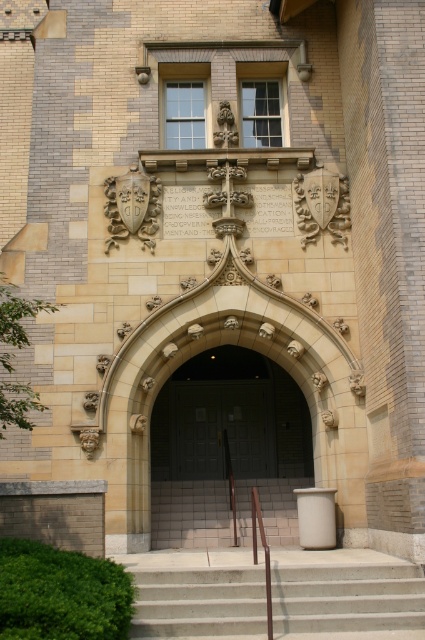
Which is above, dark gray wooden door at center or brown polished wood handrail at center?

Positioned higher is dark gray wooden door at center.

Is point (189, 534) in front of point (260, 518)?

Yes, it is in front of point (260, 518).

Measure the distance between point (x=207, y=531) and camera.

Point (x=207, y=531) and camera are 150.60 feet apart from each other.

Identify the location of dark gray wooden door at center. (229, 445).

Between concrete stairs at lower center and dark wood door at center, which one has more height?

dark wood door at center

Does point (320, 621) come in front of point (206, 477)?

Yes, point (320, 621) is closer to viewer.

At what (x,y) coordinates should I click in order to perform the action: click on concrete stairs at lower center. Please return your answer as a coordinate pair (x, y). Looking at the image, I should click on (348, 596).

How much distance is there between dark gray wooden door at center and concrete stairs at lower center?

dark gray wooden door at center is 65.93 feet away from concrete stairs at lower center.

Does dark gray wooden door at center appear on the left side of concrete stairs at lower center?

Yes, dark gray wooden door at center is to the left of concrete stairs at lower center.

The height and width of the screenshot is (640, 425). Find the location of `dark gray wooden door at center`. dark gray wooden door at center is located at coordinates (229, 445).